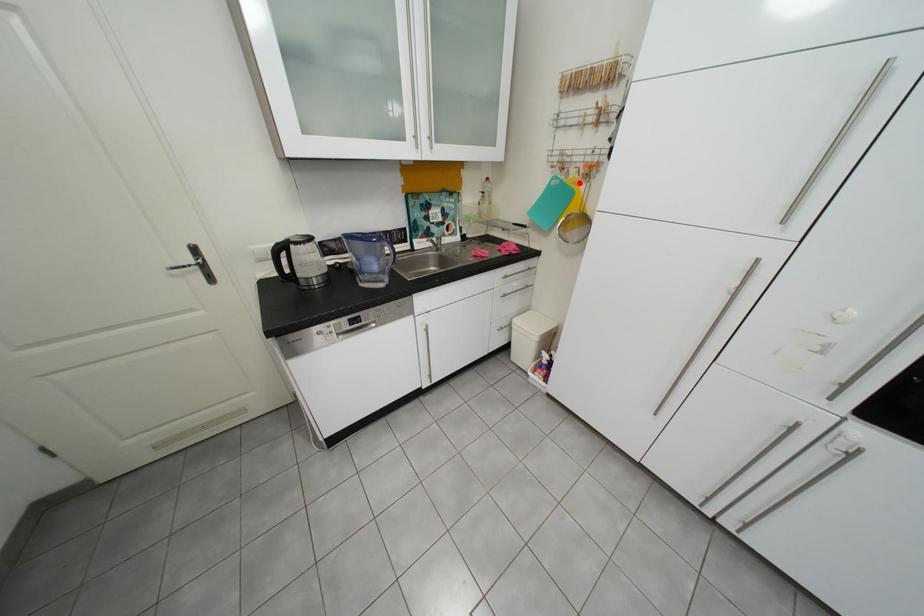
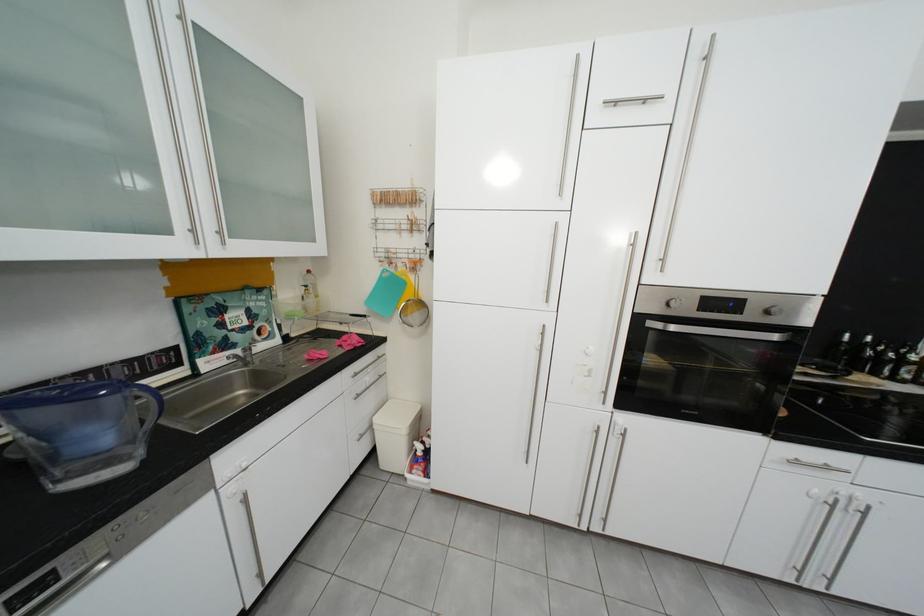
Question: I am providing you with two images of the same scene from different viewpoints. A red point is shown in image1. For the corresponding object point in image2, is it positioned nearer or farther from the camera?

Choices:
 (A) Nearer
 (B) Farther

Answer: (B)